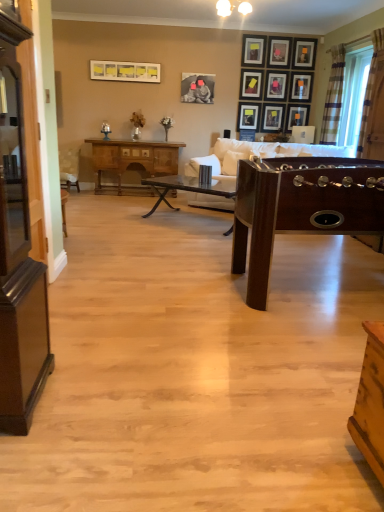
This screenshot has width=384, height=512. What are the coordinates of `free space in front of mahogany wood foosball table at right, which is the 3th table in back-to-front order` in the screenshot? It's located at pos(263,387).